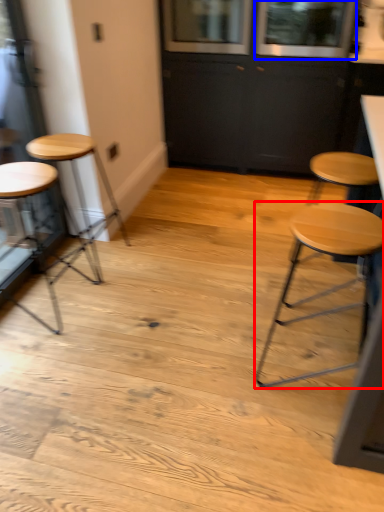
Question: Which object appears farthest to the camera in this image, stool (highlighted by a red box) or window (highlighted by a blue box)?

Choices:
 (A) stool
 (B) window

Answer: (B)